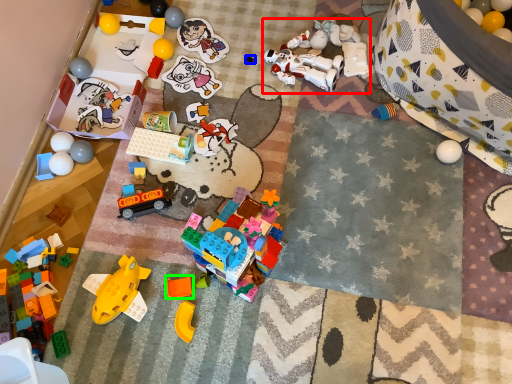
Question: Which object is positioned farthest from toy (highlighted by a red box)? Select from toy (highlighted by a blue box) and toy (highlighted by a green box).

Choices:
 (A) toy
 (B) toy

Answer: (B)